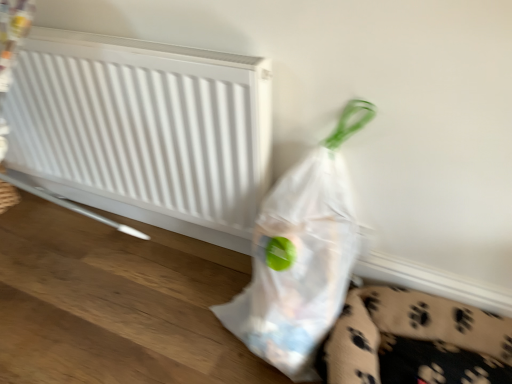
Question: Is white matte radiator at upper left smaller than transparent plastic bag at lower right?

Choices:
 (A) yes
 (B) no

Answer: (A)

Question: Can you confirm if white matte radiator at upper left is taller than transparent plastic bag at lower right?

Choices:
 (A) no
 (B) yes

Answer: (A)

Question: Does white matte radiator at upper left touch transparent plastic bag at lower right?

Choices:
 (A) yes
 (B) no

Answer: (B)

Question: From the image's perspective, is white matte radiator at upper left over transparent plastic bag at lower right?

Choices:
 (A) no
 (B) yes

Answer: (B)

Question: From the image's perspective, does white matte radiator at upper left appear lower than transparent plastic bag at lower right?

Choices:
 (A) no
 (B) yes

Answer: (A)

Question: Is white matte radiator at upper left positioned with its back to transparent plastic bag at lower right?

Choices:
 (A) no
 (B) yes

Answer: (A)

Question: Is transparent plastic bag at lower right aimed at white matte radiator at upper left?

Choices:
 (A) no
 (B) yes

Answer: (A)

Question: Is transparent plastic bag at lower right surrounding white matte radiator at upper left?

Choices:
 (A) no
 (B) yes

Answer: (A)

Question: Does transparent plastic bag at lower right come behind white matte radiator at upper left?

Choices:
 (A) no
 (B) yes

Answer: (A)

Question: Is transparent plastic bag at lower right smaller than white matte radiator at upper left?

Choices:
 (A) no
 (B) yes

Answer: (A)

Question: Is transparent plastic bag at lower right positioned before white matte radiator at upper left?

Choices:
 (A) no
 (B) yes

Answer: (B)

Question: Does transparent plastic bag at lower right appear on the left side of white matte radiator at upper left?

Choices:
 (A) no
 (B) yes

Answer: (A)

Question: From a real-world perspective, is transparent plastic bag at lower right positioned above or below white matte radiator at upper left?

Choices:
 (A) above
 (B) below

Answer: (B)